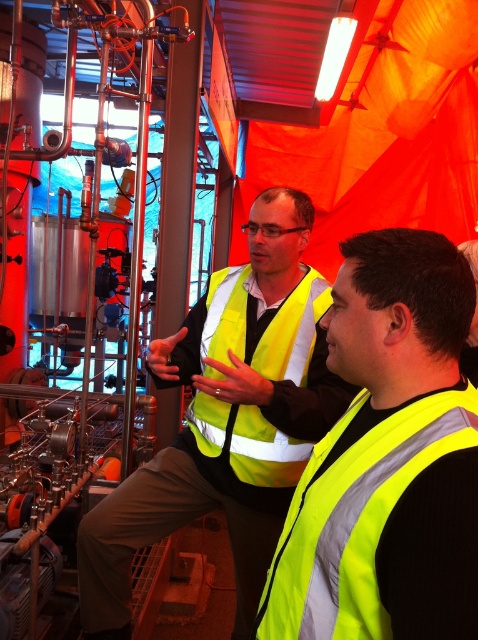
Question: Does yellow reflective vest at center appear over high-visibility fabric safety vest at center?

Choices:
 (A) no
 (B) yes

Answer: (A)

Question: Which point is closer to the camera?

Choices:
 (A) neon yellow reflective vest at center
 (B) high-visibility fabric safety vest at center

Answer: (A)

Question: Which object is the farthest from the yellow reflective vest at center?

Choices:
 (A) high-visibility fabric safety vest at center
 (B) neon yellow reflective vest at center

Answer: (B)

Question: Which point appears closest to the camera in this image?

Choices:
 (A) (322, 500)
 (B) (291, 451)
 (C) (188, 480)

Answer: (A)

Question: Is yellow reflective vest at center thinner than high-visibility fabric safety vest at center?

Choices:
 (A) no
 (B) yes

Answer: (A)

Question: Can you confirm if yellow reflective vest at center is positioned to the right of high-visibility fabric safety vest at center?

Choices:
 (A) yes
 (B) no

Answer: (B)